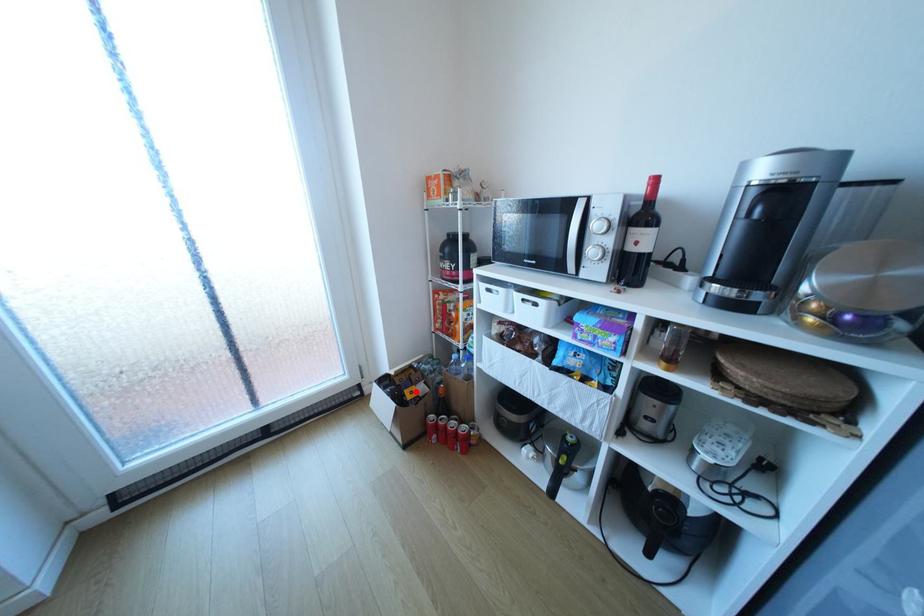
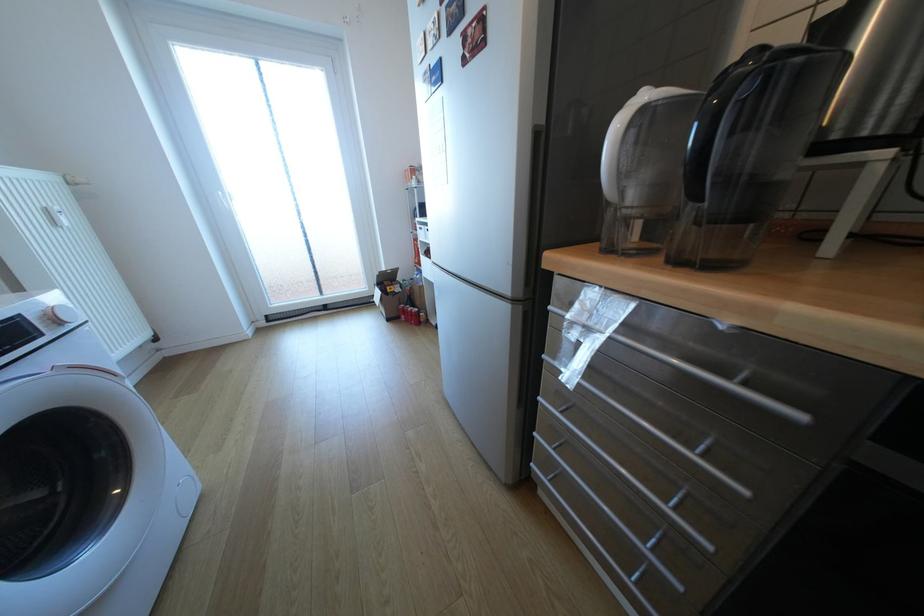
Question: I am providing you with two images of the same scene from different viewpoints. Image1 has a red point marked. In image2, the corresponding 3D location appears at what relative position? Reply with the corresponding letter.

Choices:
 (A) Closer
 (B) Farther

Answer: (A)